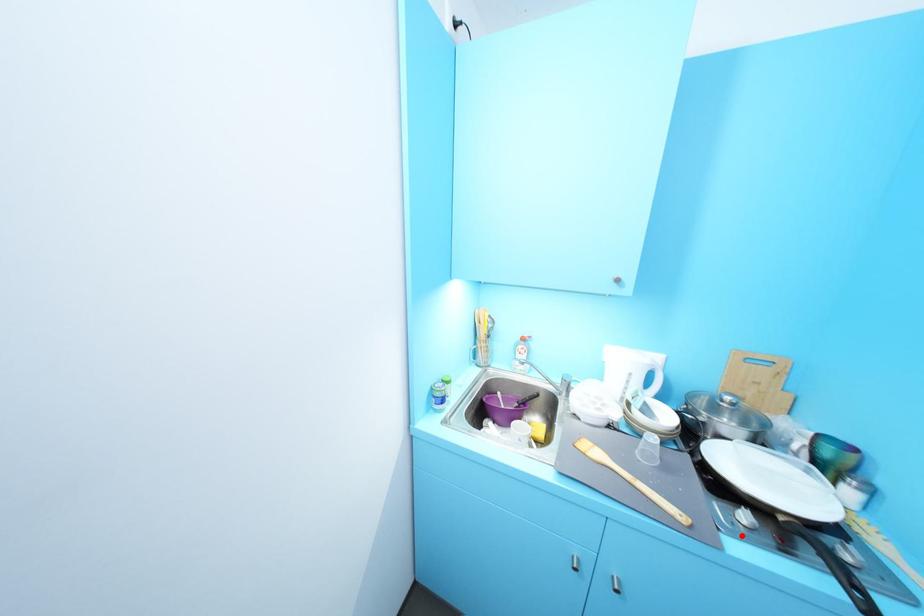
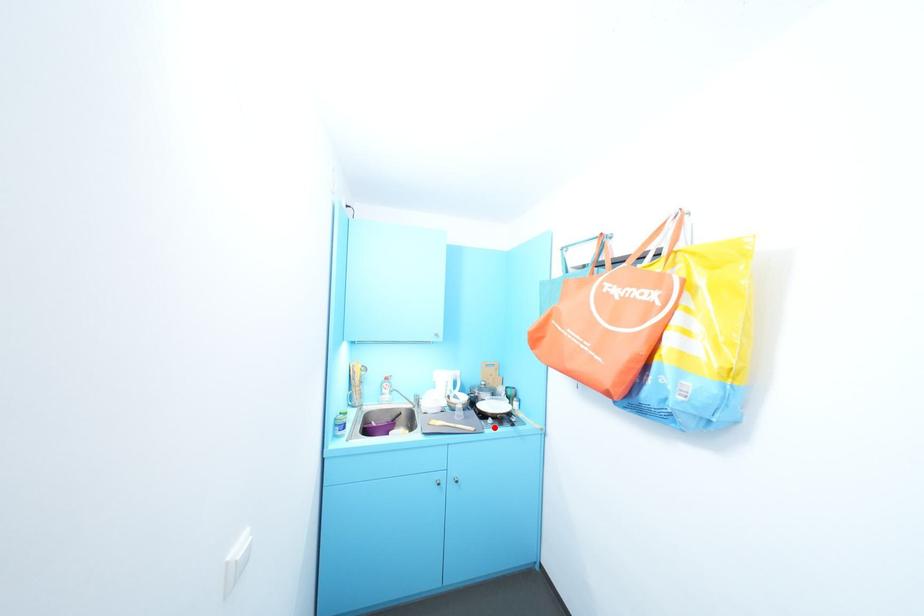
I am providing you with two images of the same scene from different viewpoints. A red point is marked on the first image and another point is marked on the second image. Do the highlighted points in image1 and image2 indicate the same real-world spot?

Yes